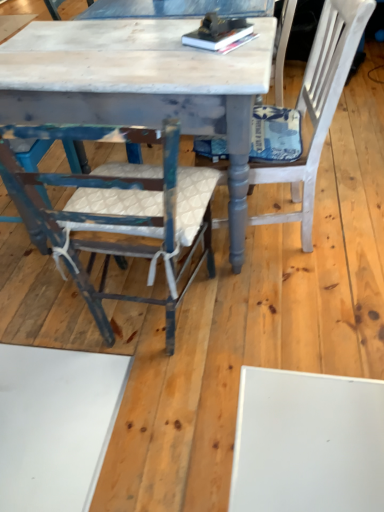
Locate an element on the screen. vacant space to the left of hardcover books at center is located at coordinates (163, 47).